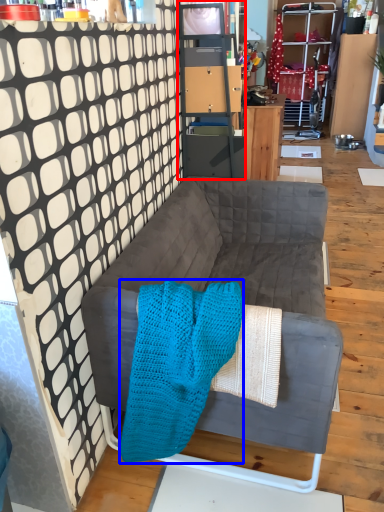
Question: Which point is further to the camera, cabinetry (highlighted by a red box) or blanket (highlighted by a blue box)?

Choices:
 (A) cabinetry
 (B) blanket

Answer: (A)